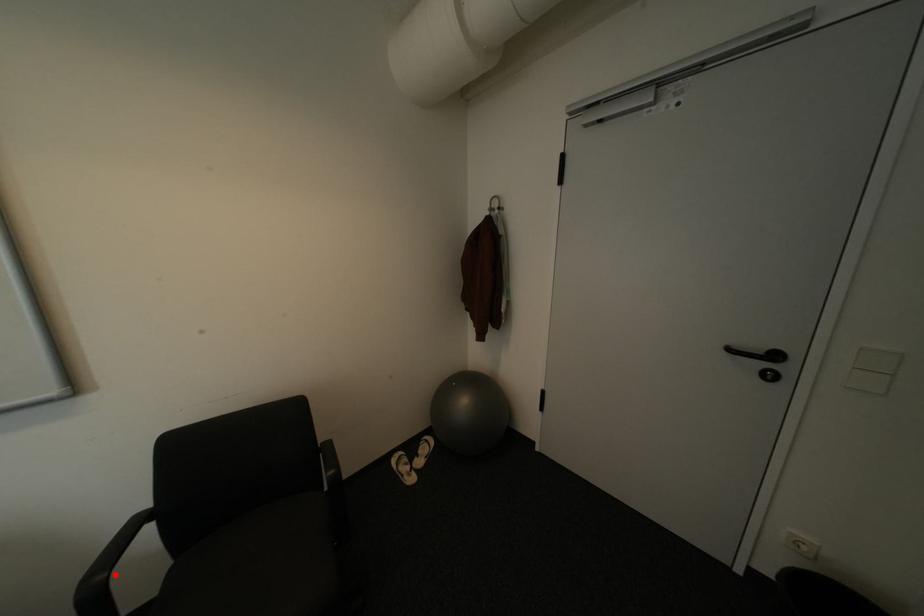
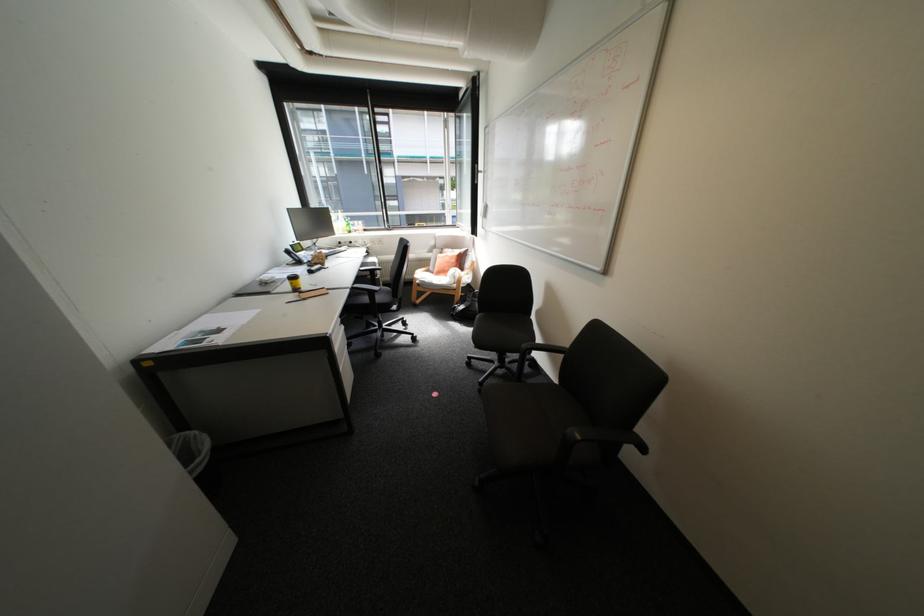
Find the pixel in the second image that matches the highlighted location in the first image.

(539, 347)